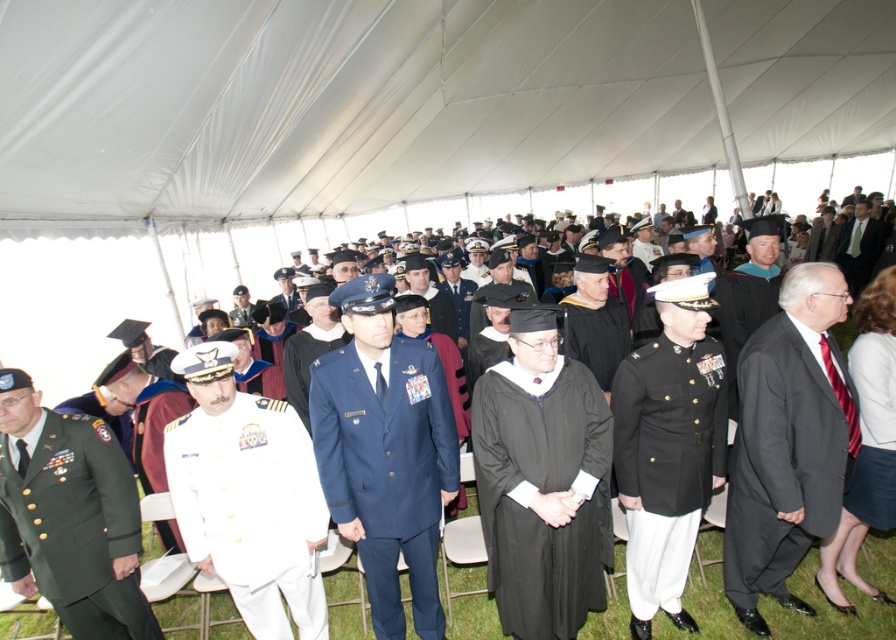
You are standing at the entrance of the tent and want to move towards the point labeled as point [868,513]. There is an obstacle at point labeled as point [498,419]. Will you encounter this obstacle before reaching your destination?

Yes, because point [498,419] is in front of point [868,513], so you will encounter the obstacle at point [498,419] before reaching your destination.

You are standing at the center of the tent and want to move towards the point marked at coordinates (780, 461). Is this point located on the black wool suit at right?

Yes, the point marked at coordinates (780, 461) is located on the black wool suit at right.

In the scene shown: You are attending a formal ceremony and need to locate the black matte graduation gown at center and the white wool blazer at center. From the perspective of someone facing the stage, which one is positioned to the left?

The black matte graduation gown at center is to the left of the white wool blazer at center from the perspective of someone facing the stage.